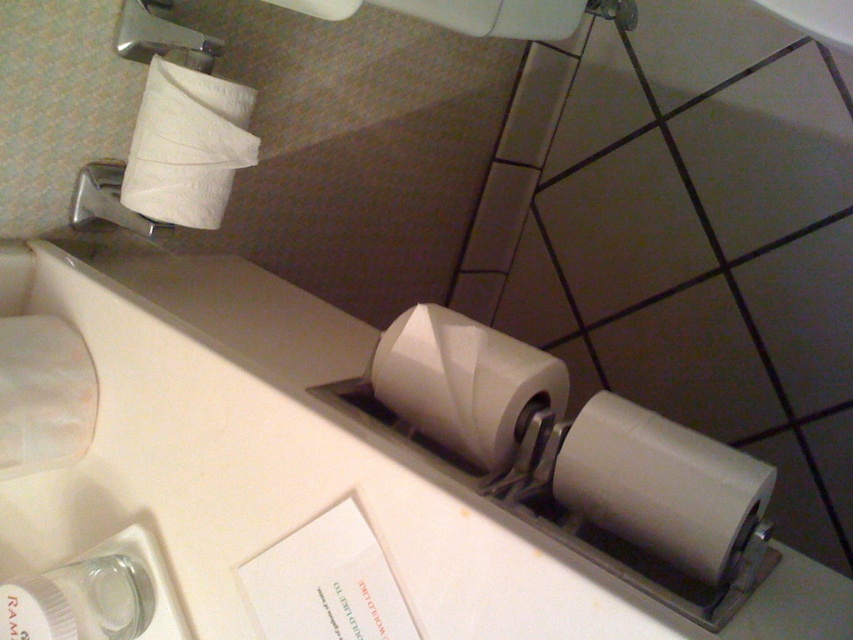
You are standing in front of the toilet paper holder and want to replace an old roll with a new one. Which toilet paper roll, the white matte toilet paper at lower center or the white matte toilet paper at upper left, is easier to reach?

The white matte toilet paper at lower center is easier to reach because it is in front of the white matte toilet paper at upper left, making it more accessible.